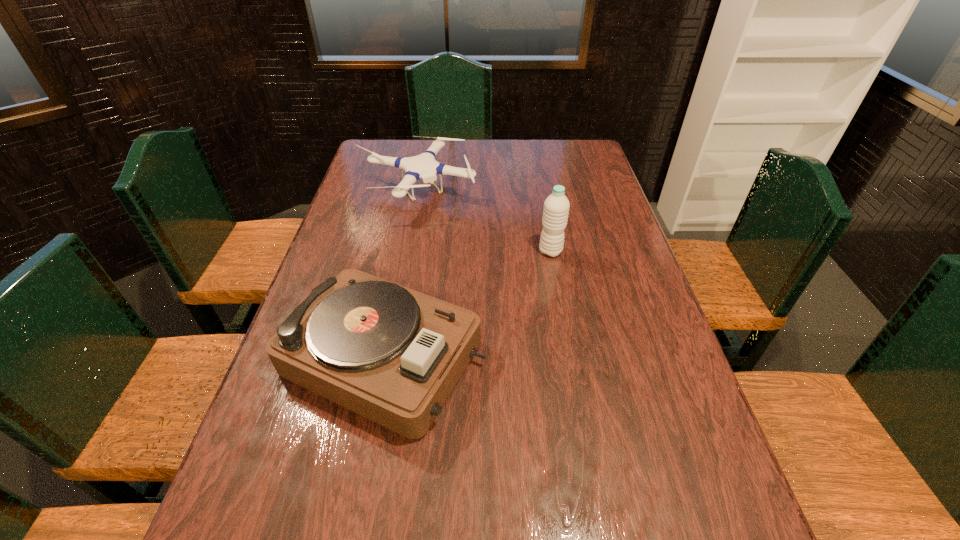
At what (x,y) coordinates should I click in order to perform the action: click on the rightmost object. Please return your answer as a coordinate pair (x, y). The width and height of the screenshot is (960, 540). Looking at the image, I should click on (556, 207).

In order to click on water bottle in this screenshot , I will do `click(556, 207)`.

Where is `record player`? This screenshot has height=540, width=960. record player is located at coordinates (393, 355).

I want to click on the farthest object, so click(424, 166).

Find the location of `vacant position located on the front of the second nearest object`. vacant position located on the front of the second nearest object is located at coordinates (570, 360).

Image resolution: width=960 pixels, height=540 pixels. I want to click on vacant space located 0.230m on the right of the record player, so click(584, 357).

The image size is (960, 540). In order to click on free point located 0.290m on the front of the drone in this screenshot , I will do `click(397, 287)`.

Locate an element on the screen. The image size is (960, 540). object that is at the far edge is located at coordinates pos(424,166).

Find the location of a particular element. The image size is (960, 540). record player located in the left edge section of the desktop is located at coordinates [393, 355].

Identify the location of drone positioned at the left edge. The image size is (960, 540). (424, 166).